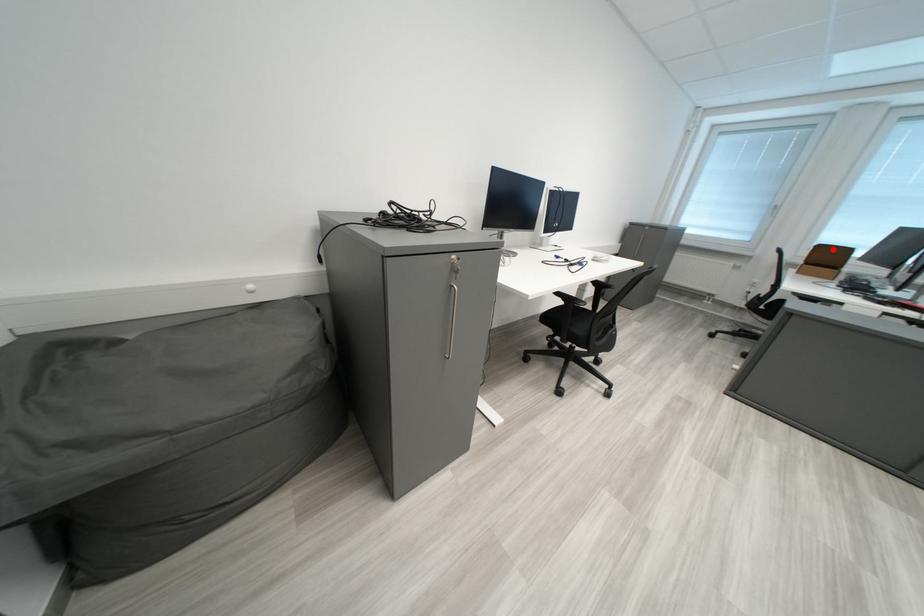
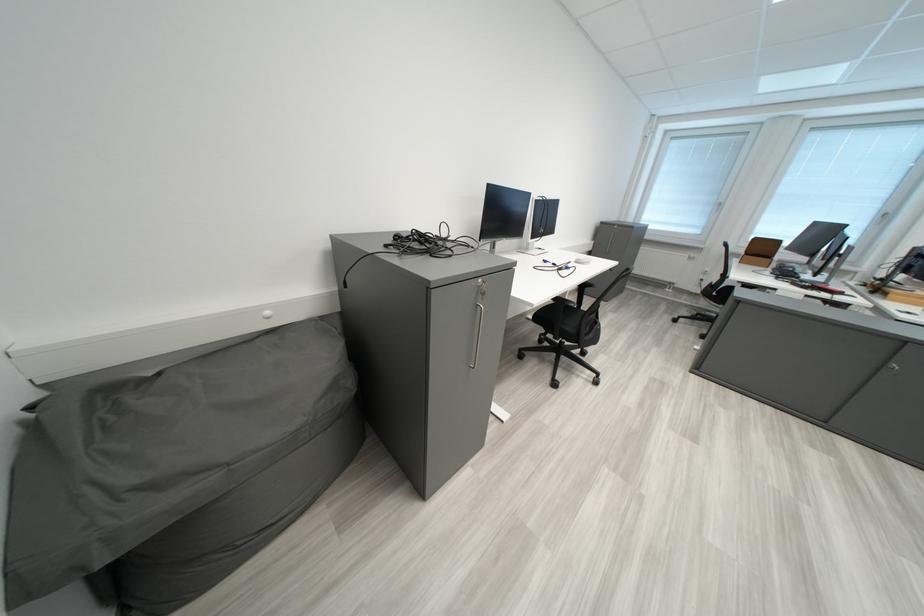
In the second image, find the point that corresponds to the highlighted location in the first image.

(769, 241)